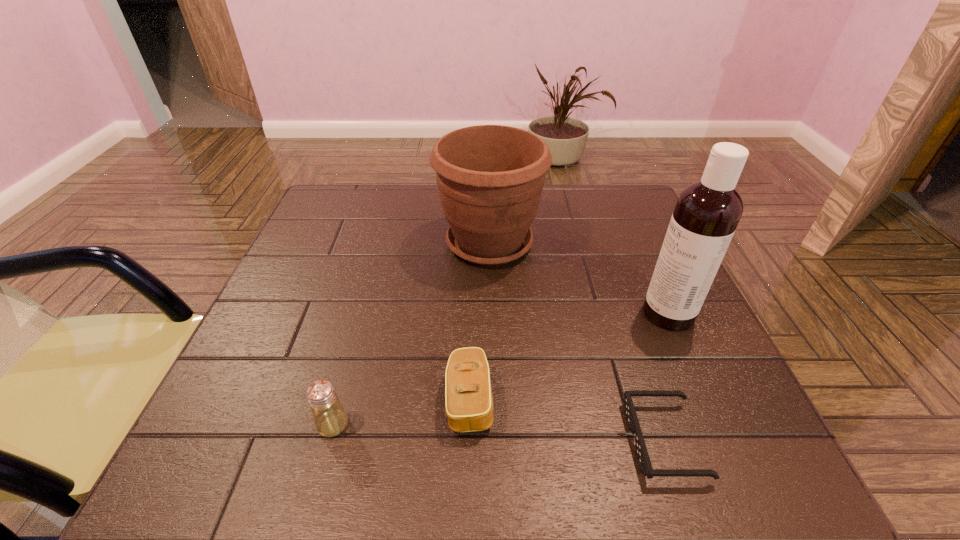
In order to click on the second farthest object in this screenshot , I will do `click(707, 212)`.

Identify the location of the tallest object. This screenshot has height=540, width=960. (707, 212).

Image resolution: width=960 pixels, height=540 pixels. I want to click on the second tallest object, so click(490, 178).

I want to click on flowerpot, so click(490, 178).

This screenshot has height=540, width=960. I want to click on the third tallest object, so click(330, 418).

The width and height of the screenshot is (960, 540). Find the location of `the leftmost object`. the leftmost object is located at coordinates [330, 418].

This screenshot has height=540, width=960. I want to click on the second shortest object, so click(x=468, y=393).

The width and height of the screenshot is (960, 540). What are the coordinates of `sunglasses` in the screenshot? It's located at (641, 452).

Locate an element on the screen. Image resolution: width=960 pixels, height=540 pixels. vacant space situated on the label side of the dishwasher detergent is located at coordinates (549, 313).

Locate an element on the screen. free space located 0.080m on the label side of the dishwasher detergent is located at coordinates (604, 313).